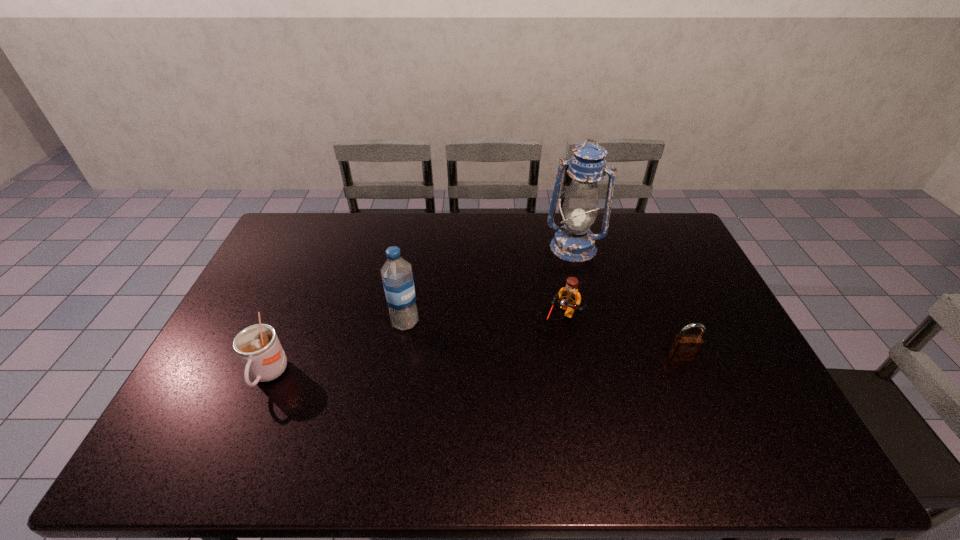
Locate an element on the screen. This screenshot has width=960, height=540. blank space that satisfies the following two spatial constraints: 1. on the back side of the Lego; 2. on the right side of the tallest object is located at coordinates (548, 247).